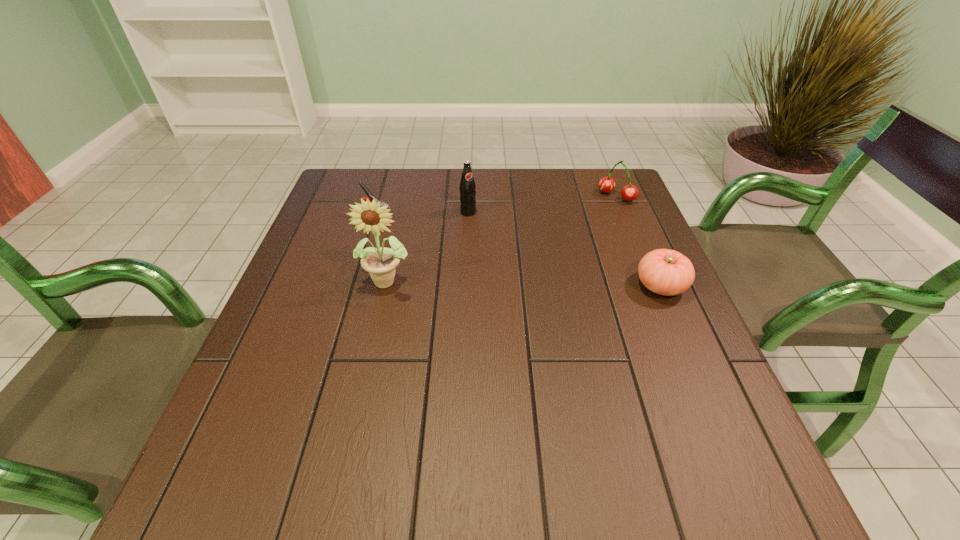
In order to click on the tallest object in this screenshot , I will do `click(381, 263)`.

Where is `tomato`? tomato is located at coordinates (666, 272).

Locate an element on the screen. The image size is (960, 540). the third object from right to left is located at coordinates (467, 188).

This screenshot has height=540, width=960. Identify the location of pop. (467, 188).

This screenshot has width=960, height=540. What are the coordinates of `cherry` in the screenshot? It's located at (630, 192).

The image size is (960, 540). I want to click on stapler, so click(x=370, y=197).

Locate an element on the screen. free space located 0.130m on the front-facing side of the tallest object is located at coordinates (374, 343).

Identify the location of vacant area situated 0.100m on the left of the tomato. The width and height of the screenshot is (960, 540). (591, 286).

Where is `vacant space located on the front label of the fourth shortest object`? vacant space located on the front label of the fourth shortest object is located at coordinates (556, 293).

Locate an element on the screen. Image resolution: width=960 pixels, height=540 pixels. vacant space located 0.180m on the front label of the fourth shortest object is located at coordinates (510, 251).